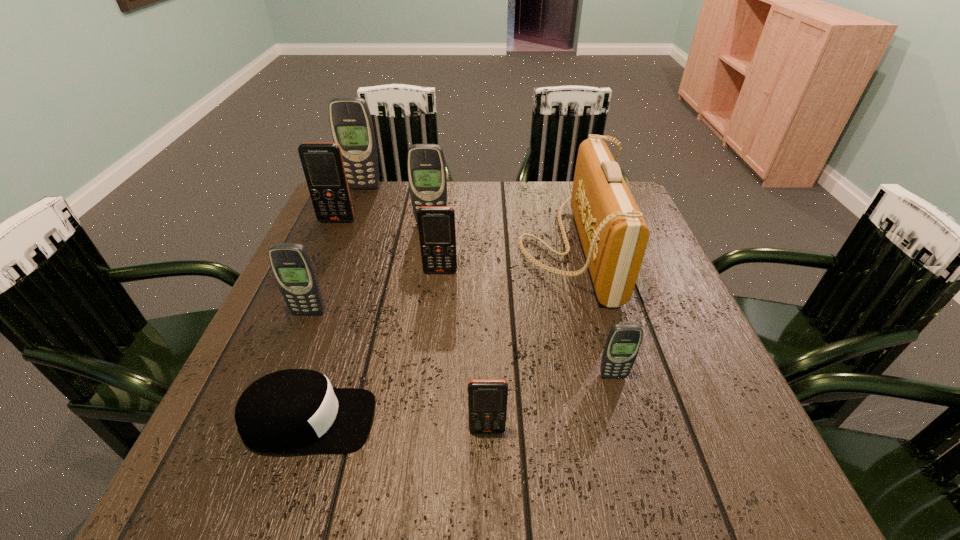
Find the location of a particular element. free space that satisfies the following two spatial constraints: 1. on the decorative side of the handbag; 2. on the screen of the second smallest gray cellular telephone is located at coordinates (587, 313).